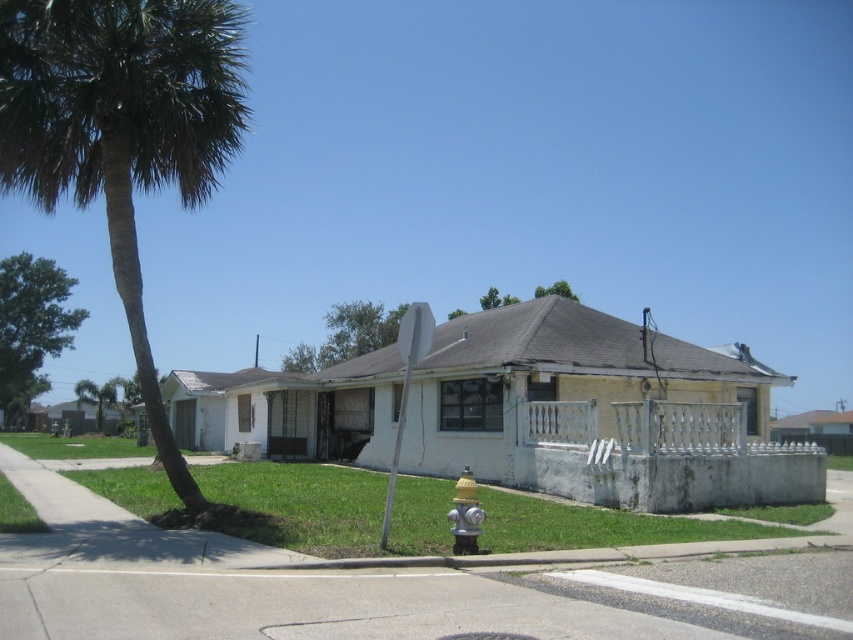
You are standing on the sidewalk in front of the house. You see the green leafy palm tree at left and the yellow metallic fire hydrant at lower center. Which object is positioned to the left of the other?

The green leafy palm tree at left is positioned to the left of the yellow metallic fire hydrant at lower center.

You are standing on the sidewalk in front of the house and want to walk towards the green leafy tree at upper center. Which direction should you walk to avoid the green leafy tree at upper left?

Since the green leafy tree at upper left is located below the green leafy tree at upper center, you should walk towards the upper direction to reach the green leafy tree at upper center while avoiding the one below it.